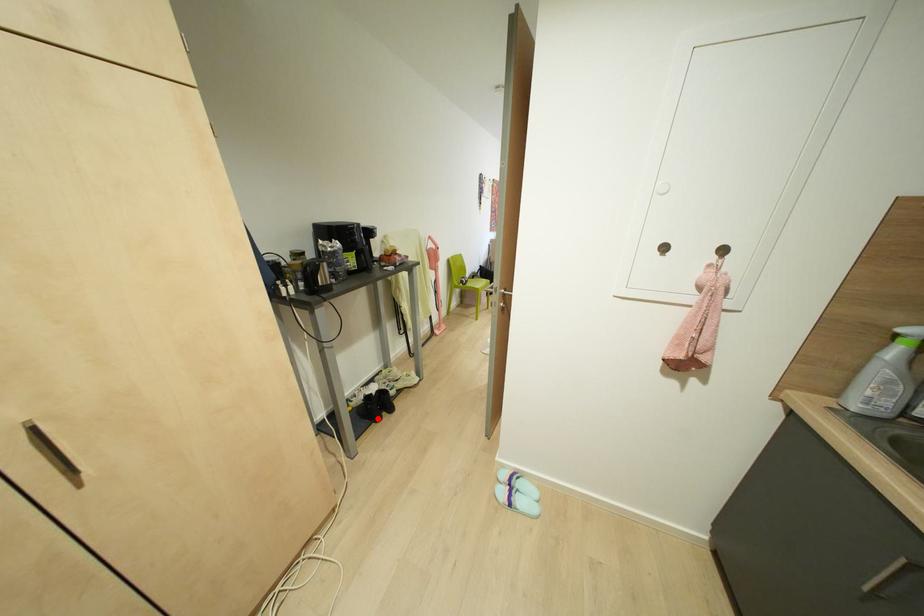
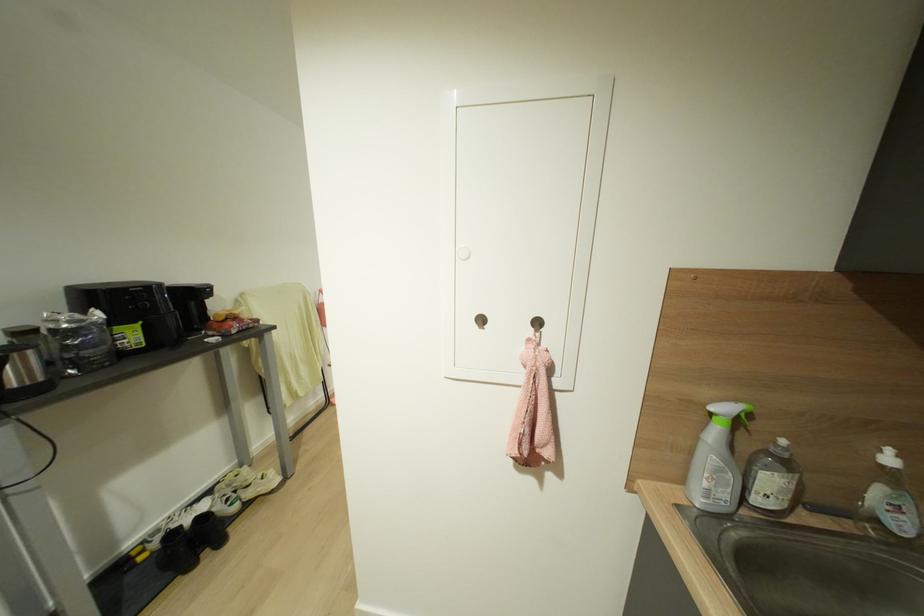
Where in the second image is the point corresponding to the highlighted location from the first image?

(189, 565)